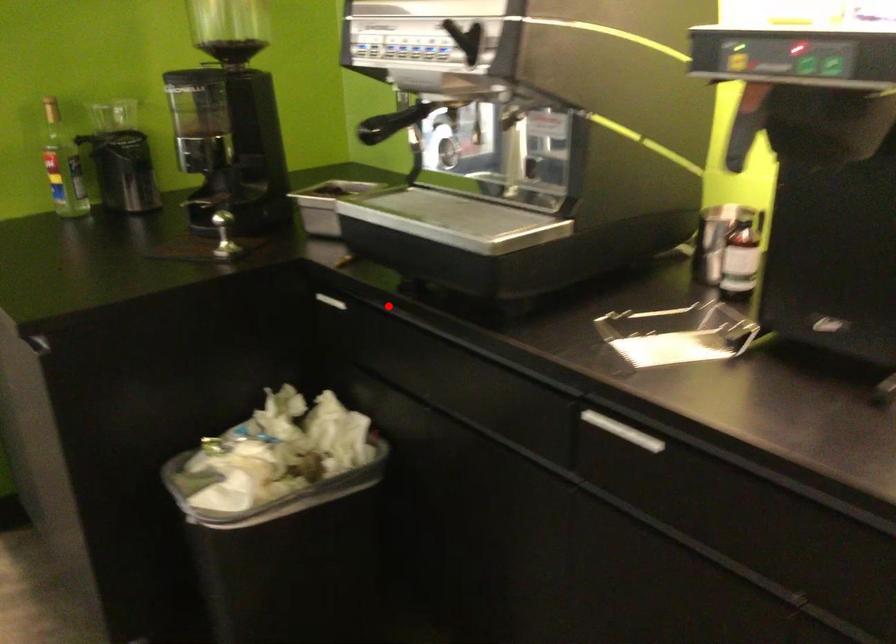
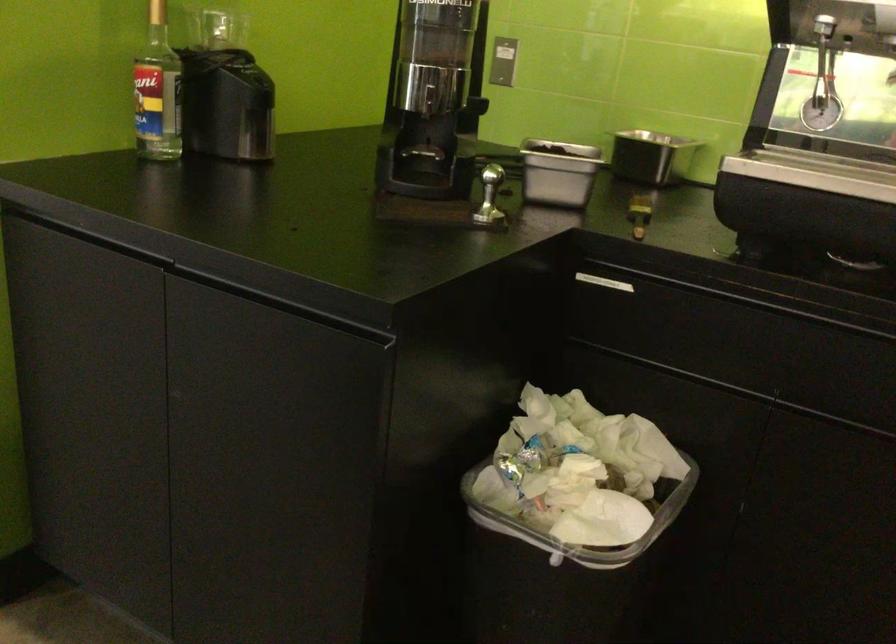
In the second image, find the point that corresponds to the highlighted location in the first image.

(744, 287)